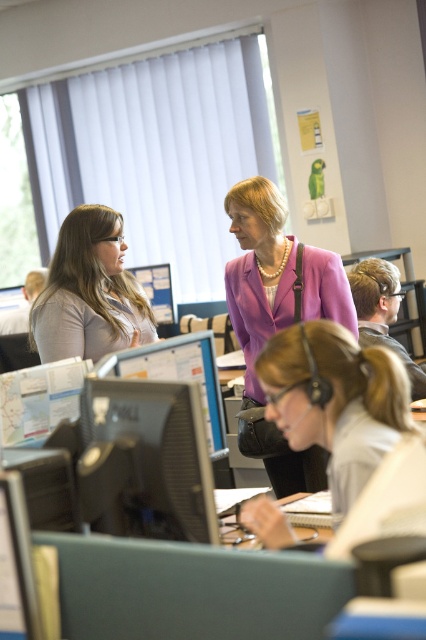
From the picture: Can you confirm if black glossy monitor at center is bigger than matte gray shirt at left?

Incorrect, black glossy monitor at center is not larger than matte gray shirt at left.

Who is positioned more to the left, black glossy monitor at center or matte gray shirt at left?

matte gray shirt at left is more to the left.

Identify the location of black glossy monitor at center. The image size is (426, 640). (146, 460).

Is black glossy monitor at center thinner than matte black monitor at center?

Correct, black glossy monitor at center's width is less than matte black monitor at center's.

Does point (138, 502) come farther from viewer compared to point (204, 413)?

That is False.

Where is `black glossy monitor at center`? This screenshot has width=426, height=640. black glossy monitor at center is located at coordinates (146, 460).

Where is `light brown hair at center`? The height and width of the screenshot is (640, 426). light brown hair at center is located at coordinates (336, 401).

Is light brown hair at center to the left of black glossy monitor at center from the viewer's perspective?

No, light brown hair at center is not to the left of black glossy monitor at center.

I want to click on light brown hair at center, so coord(336,401).

Where is `light brown hair at center`? The height and width of the screenshot is (640, 426). light brown hair at center is located at coordinates (x=336, y=401).